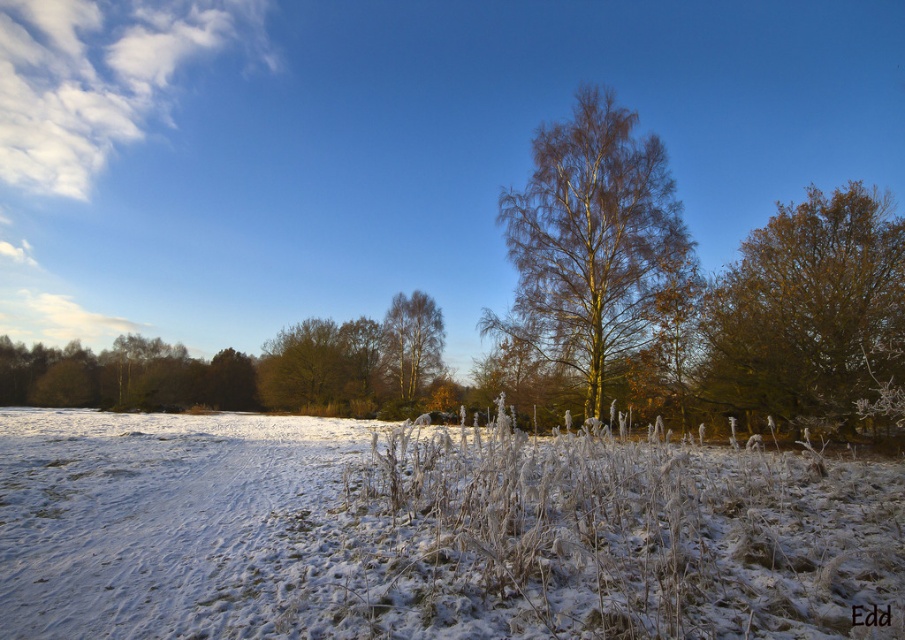
Is white frosty grass at center behind smooth silver birch at center?

No, white frosty grass at center is closer to the viewer.

Is point (424, 429) closer to viewer compared to point (414, 348)?

Yes, it is in front of point (414, 348).

Find the location of a particular element. The image size is (905, 640). white frosty grass at center is located at coordinates (431, 532).

Does white frosty grass at center appear over brown textured tree at right?

No, white frosty grass at center is not above brown textured tree at right.

Is point (96, 493) positioned after point (903, 326)?

No, (96, 493) is in front of (903, 326).

Does point (543, 474) come behind point (758, 358)?

No, (543, 474) is in front of (758, 358).

Where is `white frosty grass at center`? white frosty grass at center is located at coordinates (431, 532).

Between point (884, 202) and point (574, 260), which one is positioned in front?

Positioned in front is point (884, 202).

Is brown textured tree at right bigger than golden-brown bark tree at center?

Actually, brown textured tree at right might be smaller than golden-brown bark tree at center.

Measure the distance between brown textured tree at right and camera.

brown textured tree at right and camera are 40.50 feet apart from each other.

In order to click on brown textured tree at right in this screenshot , I will do `click(808, 310)`.